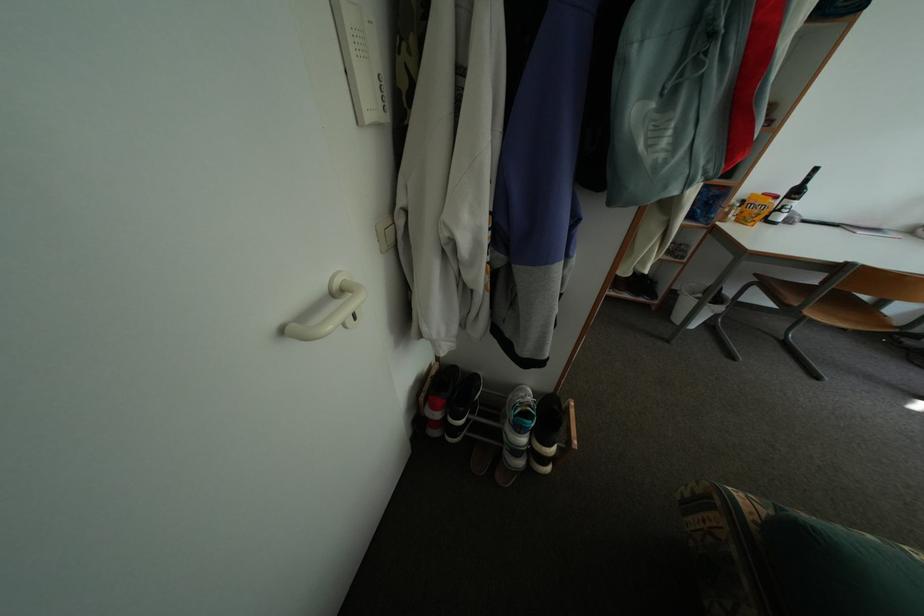
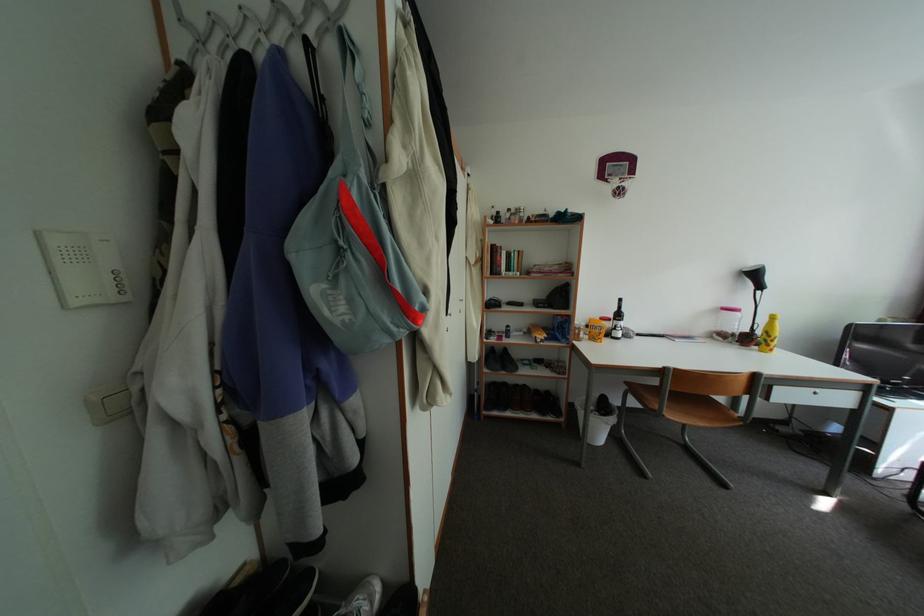
Question: The images are taken continuously from a first-person perspective. In which direction is your viewpoint rotating?

Choices:
 (A) Left
 (B) Right
 (C) Up
 (D) Down

Answer: (C)